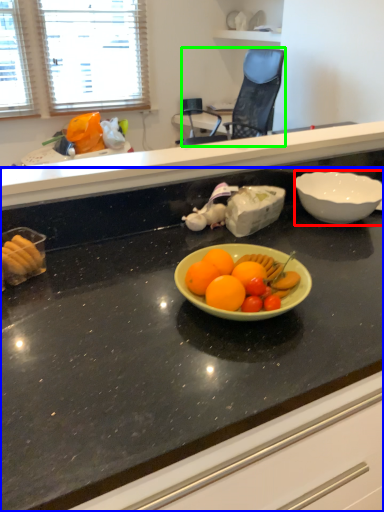
Question: Based on their relative distances, which object is farther from bowl (highlighted by a red box)? Choose from countertop (highlighted by a blue box) and chair (highlighted by a green box).

Choices:
 (A) countertop
 (B) chair

Answer: (B)